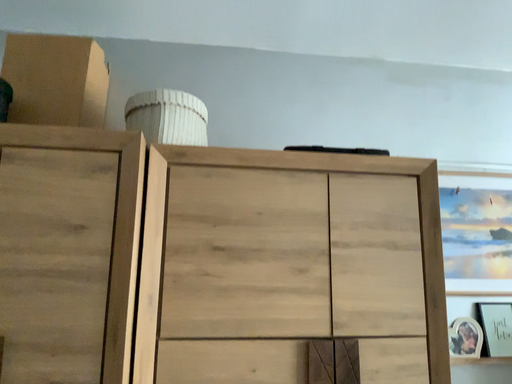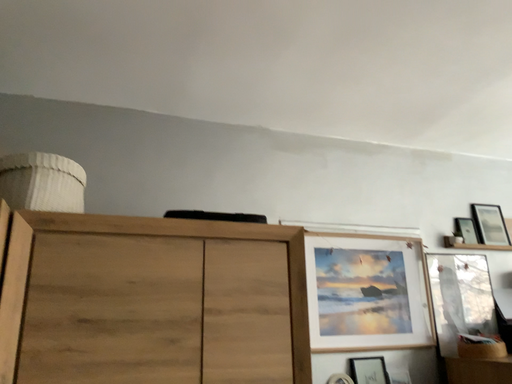
Question: Which way did the camera rotate in the video?

Choices:
 (A) rotated right
 (B) rotated left

Answer: (A)